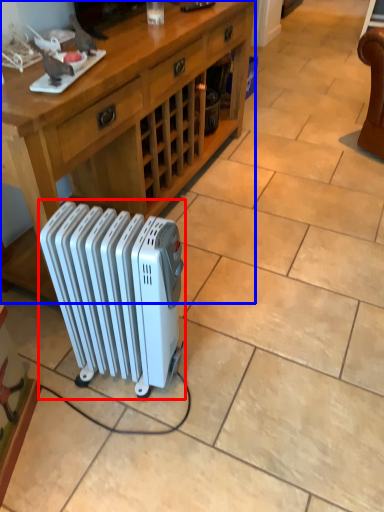
Question: Among these objects, which one is nearest to the camera, radiator (highlighted by a red box) or desk (highlighted by a blue box)?

Choices:
 (A) radiator
 (B) desk

Answer: (A)